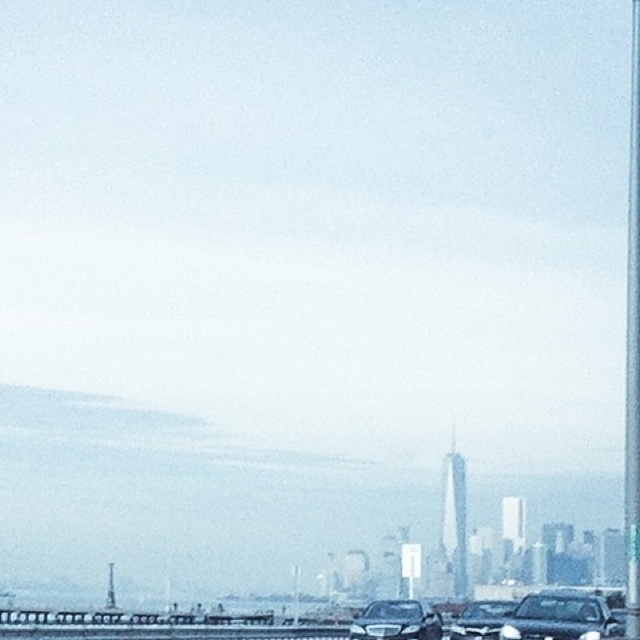
Is metallic pole at right further to the viewer compared to sleek black car at lower right?

No.

Who is positioned more to the right, metallic pole at right or sleek black car at lower right?

Positioned to the right is metallic pole at right.

Measure the distance between metallic pole at right and camera.

metallic pole at right and camera are 40.20 meters apart.

This screenshot has width=640, height=640. Find the location of `metallic pole at right`. metallic pole at right is located at coordinates (632, 349).

Is shiny black sedan at lower right above sleek black car at center?

Yes.

Can you confirm if shiny black sedan at lower right is positioned to the right of sleek black car at center?

Yes, shiny black sedan at lower right is to the right of sleek black car at center.

Is point (541, 620) positioned behind point (380, 625)?

No, it is not.

Locate an element on the screen. shiny black sedan at lower right is located at coordinates (561, 618).

Does point (634, 387) lie behind point (396, 630)?

No, it is in front of (396, 630).

Is metallic pole at right shorter than sleek black car at center?

In fact, metallic pole at right may be taller than sleek black car at center.

This screenshot has height=640, width=640. What do you see at coordinates (632, 349) in the screenshot? I see `metallic pole at right` at bounding box center [632, 349].

Where is `metallic pole at right`? metallic pole at right is located at coordinates (632, 349).